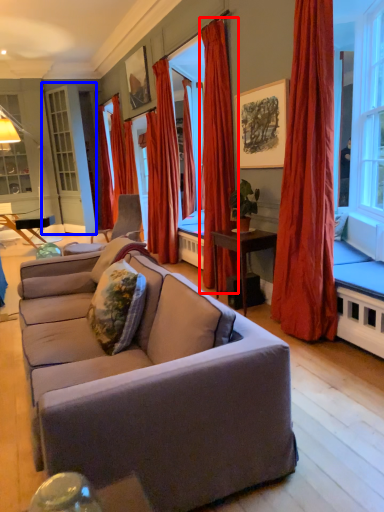
Question: Which of the following is the farthest to the observer, curtain (highlighted by a red box) or screen door (highlighted by a blue box)?

Choices:
 (A) curtain
 (B) screen door

Answer: (B)